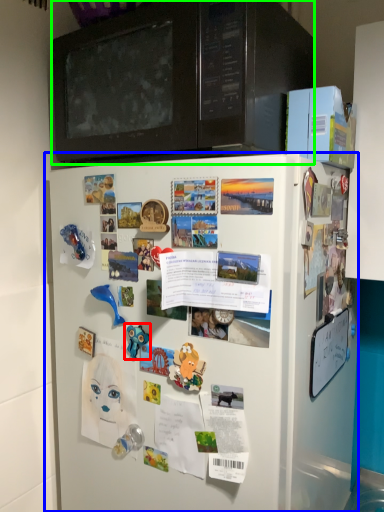
Question: Estimate the real-world distances between objects in this image. Which object is closer to toy (highlighted by a red box), refrigerator (highlighted by a blue box) or microwave oven (highlighted by a green box)?

Choices:
 (A) refrigerator
 (B) microwave oven

Answer: (A)